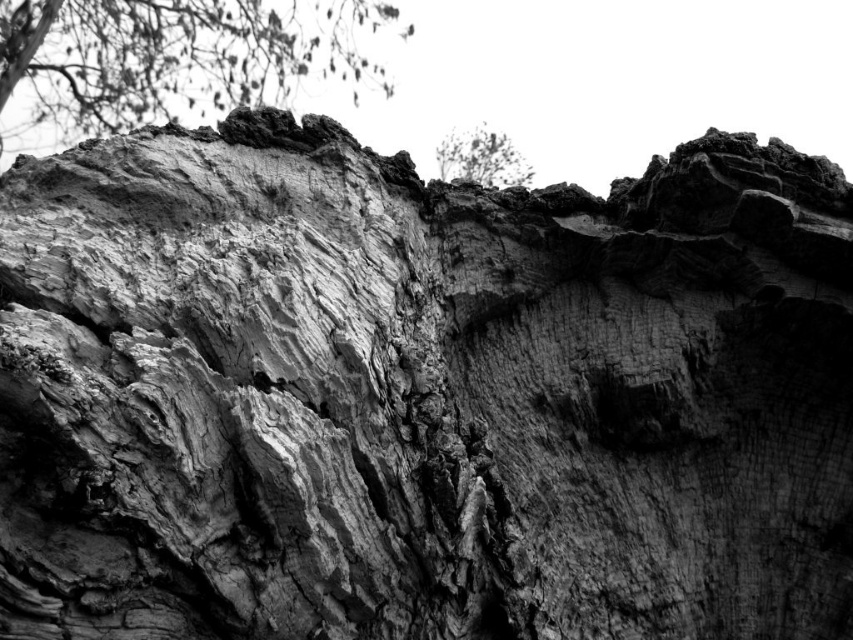
Question: Which of the following is the farthest from the observer?

Choices:
 (A) (486, 180)
 (B) (347, 51)

Answer: (B)

Question: Is rough bark tree trunk at upper left behind dark gray textured bark at upper center?

Choices:
 (A) no
 (B) yes

Answer: (B)

Question: Does rough bark tree trunk at upper left appear on the right side of dark gray textured bark at upper center?

Choices:
 (A) yes
 (B) no

Answer: (B)

Question: Which point is closer to the camera?

Choices:
 (A) rough bark tree trunk at upper left
 (B) dark gray textured bark at upper center

Answer: (B)

Question: Does rough bark tree trunk at upper left have a lesser width compared to dark gray textured bark at upper center?

Choices:
 (A) yes
 (B) no

Answer: (B)